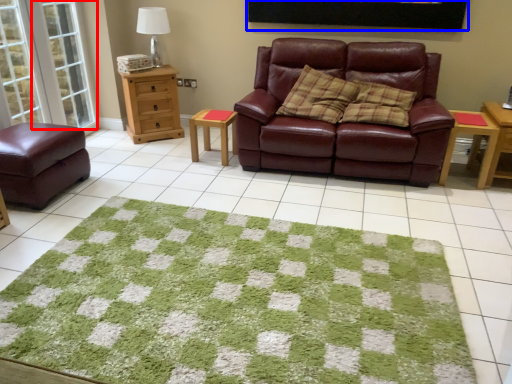
Question: Which object is closer to the camera taking this photo, glass door (highlighted by a red box) or picture frame (highlighted by a blue box)?

Choices:
 (A) glass door
 (B) picture frame

Answer: (B)